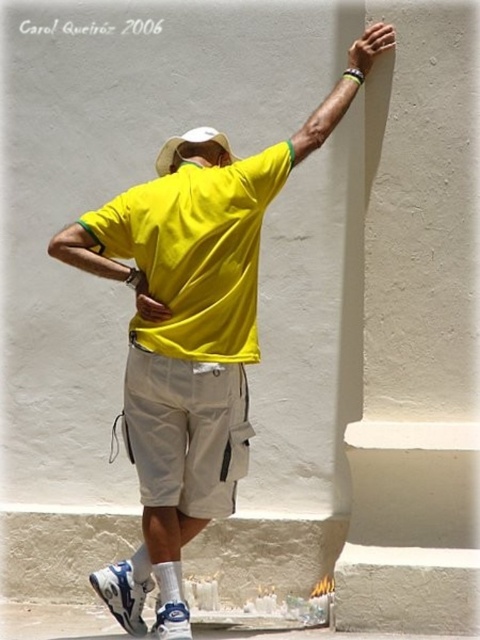
Find the location of `white matte baseball hat at back`. white matte baseball hat at back is located at coordinates (189, 141).

Is point (216, 134) in front of point (141, 305)?

No.

In the scene shown: Who is more distant from viewer, (165, 168) or (147, 305)?

Positioned behind is point (165, 168).

Locate an element on the screen. white matte baseball hat at back is located at coordinates (189, 141).

Is point (361, 38) farther from viewer compared to point (135, 298)?

No, (361, 38) is closer to viewer.

Where is `white matte hand at upper right`? This screenshot has width=480, height=640. white matte hand at upper right is located at coordinates (370, 45).

Based on the photo, does white matte hand at upper right appear on the right side of white matte baseball hat at back?

Correct, you'll find white matte hand at upper right to the right of white matte baseball hat at back.

Is point (387, 29) less distant than point (203, 125)?

Yes.

Does point (363, 38) come closer to viewer compared to point (171, 140)?

Yes, it is in front of point (171, 140).

Locate an element on the screen. This screenshot has width=480, height=640. white matte hand at upper right is located at coordinates (370, 45).